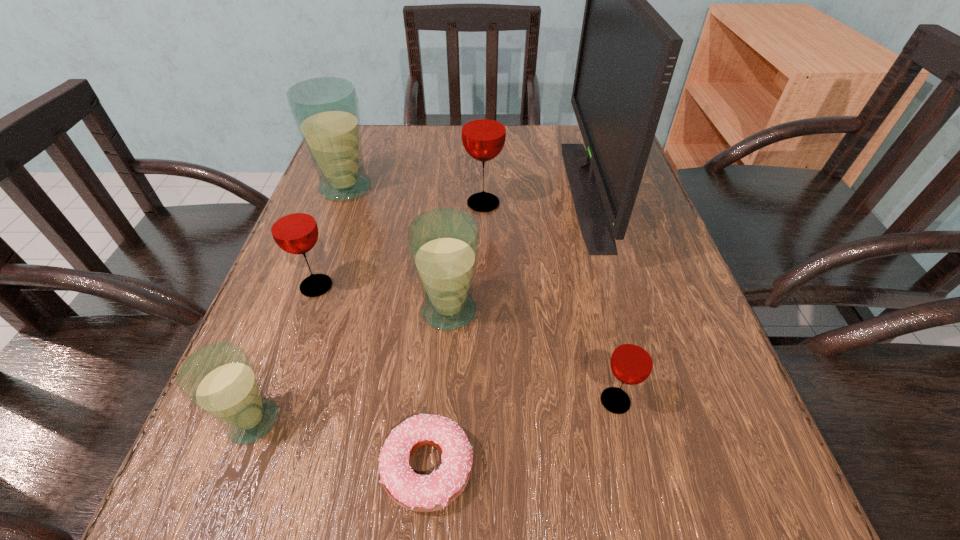
I want to click on blank space at the far edge of the desktop, so tap(438, 135).

At what (x,y) coordinates should I click in order to perform the action: click on free space at the near edge of the desktop. Please return your answer as a coordinate pair (x, y). Image resolution: width=960 pixels, height=540 pixels. Looking at the image, I should click on [542, 531].

Find the location of a particular element. This screenshot has height=540, width=960. vacant area at the left edge of the desktop is located at coordinates (293, 295).

Locate an element on the screen. This screenshot has width=960, height=540. vacant space at the right edge of the desktop is located at coordinates (609, 255).

At what (x,y) coordinates should I click in order to perform the action: click on vacant area at the far left corner. Please return your answer as a coordinate pair (x, y). The image size is (960, 540). Looking at the image, I should click on [x=380, y=127].

Locate an element on the screen. vacant area between the smallest blue glass and the second red glass from right to left is located at coordinates (368, 312).

Where is `free space between the smallest red glass and the doughnut`? The width and height of the screenshot is (960, 540). free space between the smallest red glass and the doughnut is located at coordinates (521, 434).

Identify the location of free area in between the smallest blue glass and the doughnut. (340, 444).

I want to click on vacant space that is in between the second red glass from left to right and the smallest blue glass, so click(368, 312).

Identify the location of vacant space that's between the rightmost red glass and the rightmost blue glass. The height and width of the screenshot is (540, 960). (532, 356).